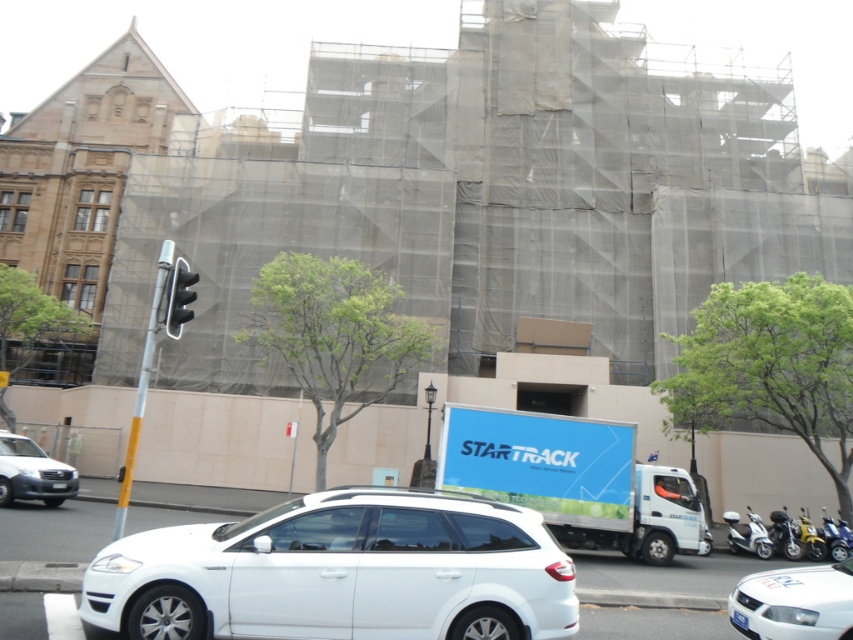
You are a delivery driver who needs to park your StarTrack truck next to the black plastic traffic light at left. The parking space available is exactly the width of the silver metallic sedan at lower left. Will your truck fit in this space?

The silver metallic sedan at lower left is narrower than the black plastic traffic light at left, but the question is about the truck fitting in a space the width of the sedan. Since the truck is larger than the sedan, it won not fit in the space.

You are a delivery driver who needs to park your van near the construction site. You see the silver metallic sedan at lower left and the black plastic traffic light at left. Which vehicle is shorter in height?

The silver metallic sedan at lower left has a lesser height compared to the black plastic traffic light at left, so the silver metallic sedan at lower left is shorter in height.